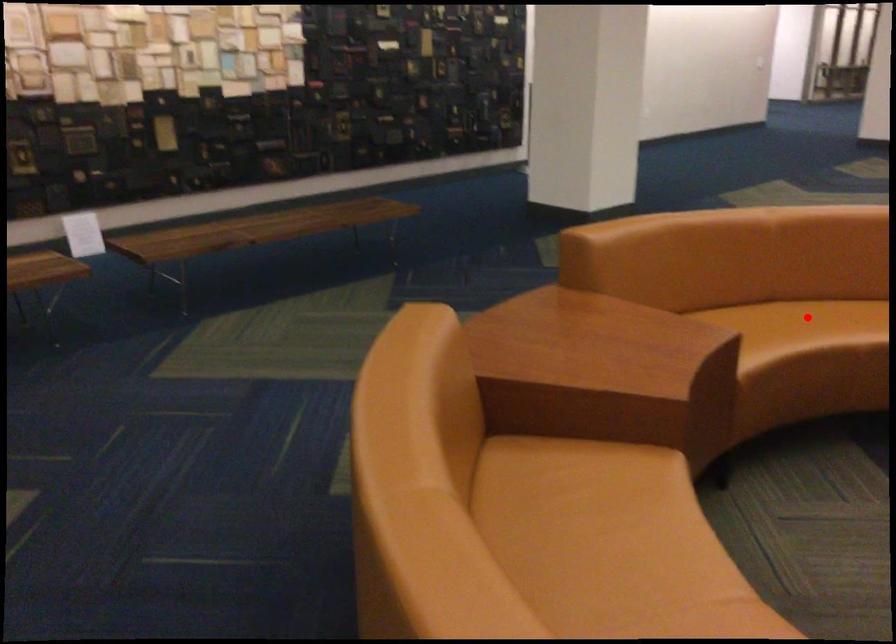
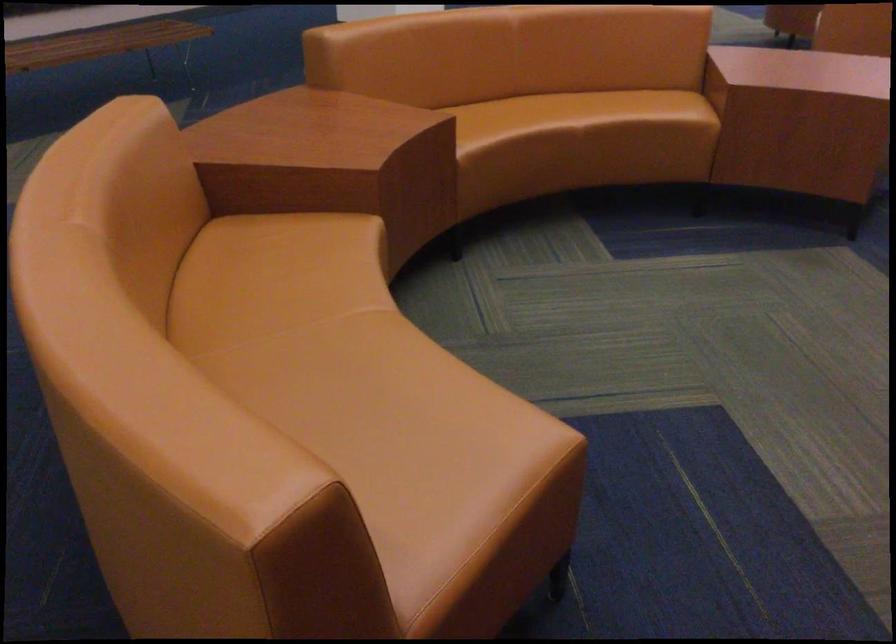
Question: I am providing you with two images of the same scene from different viewpoints. In image1, a red point is highlighted. Considering the same 3D point in image2, which of the following is correct?

Choices:
 (A) It is closer
 (B) It is farther

Answer: (B)